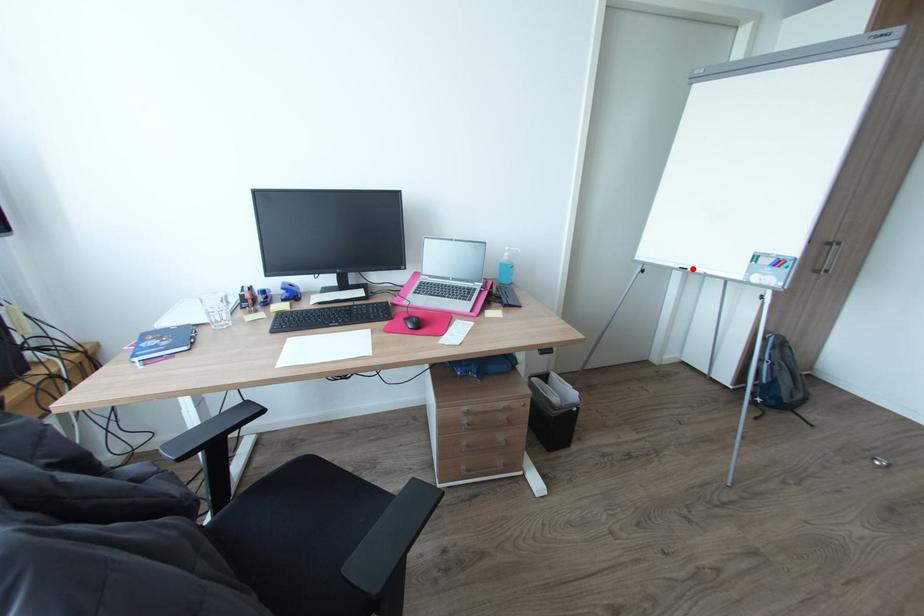
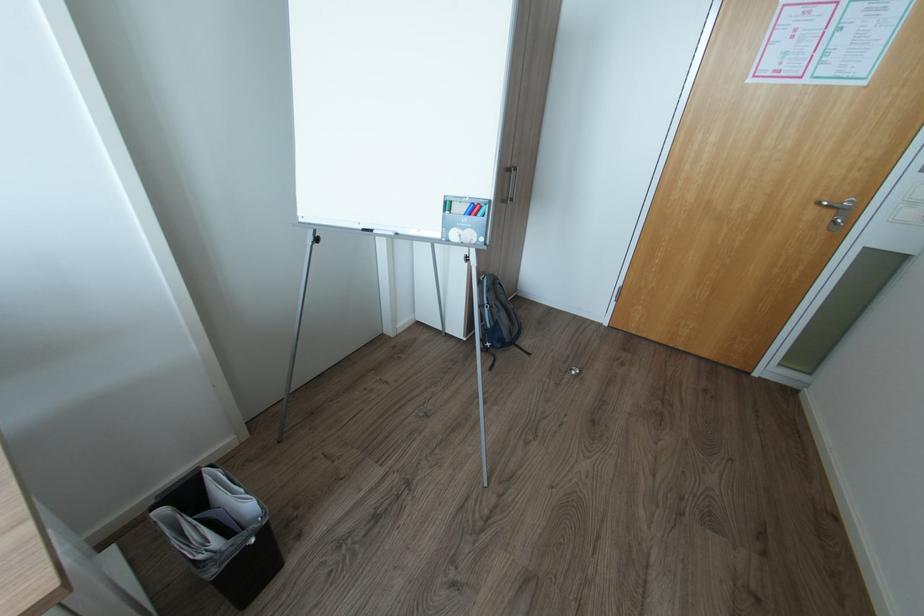
The point at the highlighted location is marked in the first image. Where is the corresponding point in the second image?

(380, 231)